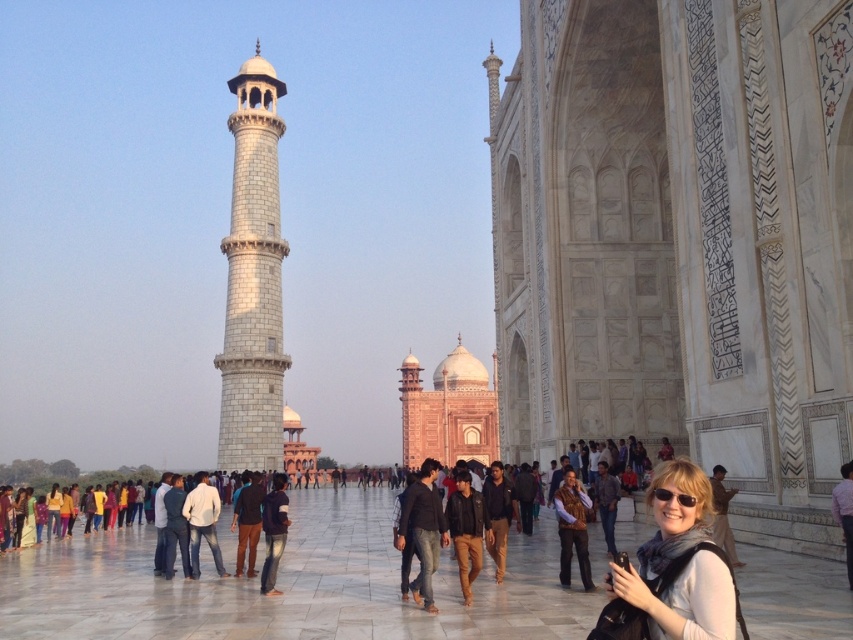
Question: Is white marble tower at center below matte pink shirt at lower left?

Choices:
 (A) no
 (B) yes

Answer: (A)

Question: Based on their relative distances, which object is farther from the white marble tower at center?

Choices:
 (A) matte white scarf at lower right
 (B) matte pink shirt at lower left
 (C) white marble minaret at center-left
 (D) matte black sunglasses at lower right

Answer: (D)

Question: Which point is farther to the camera?

Choices:
 (A) (229, 403)
 (B) (491, 516)

Answer: (A)

Question: Which is nearer to the matte black sunglasses at lower right?

Choices:
 (A) white marble tower at center
 (B) dark blue fabric jacket at center
 (C) matte white scarf at lower right

Answer: (C)

Question: Is white marble tower at center further to the viewer compared to matte pink shirt at lower left?

Choices:
 (A) yes
 (B) no

Answer: (A)

Question: Does matte pink shirt at lower left appear on the right side of matte black sunglasses at lower right?

Choices:
 (A) yes
 (B) no

Answer: (B)